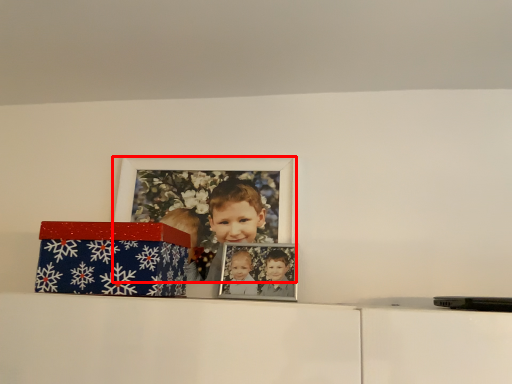
Question: From the image's perspective, considering the relative positions of picture frame (annotated by the red box) and box in the image provided, where is picture frame (annotated by the red box) located with respect to the staircase?

Choices:
 (A) above
 (B) below

Answer: (A)